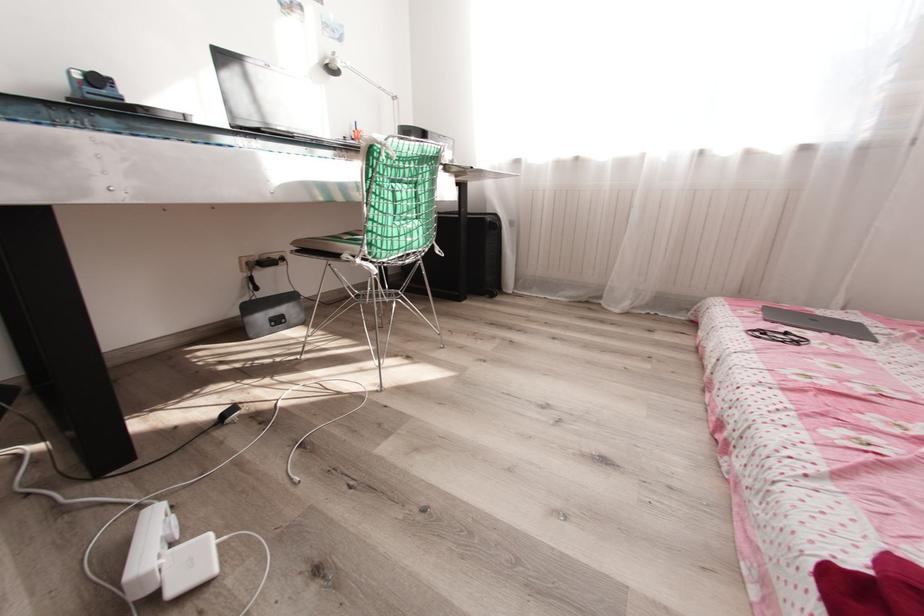
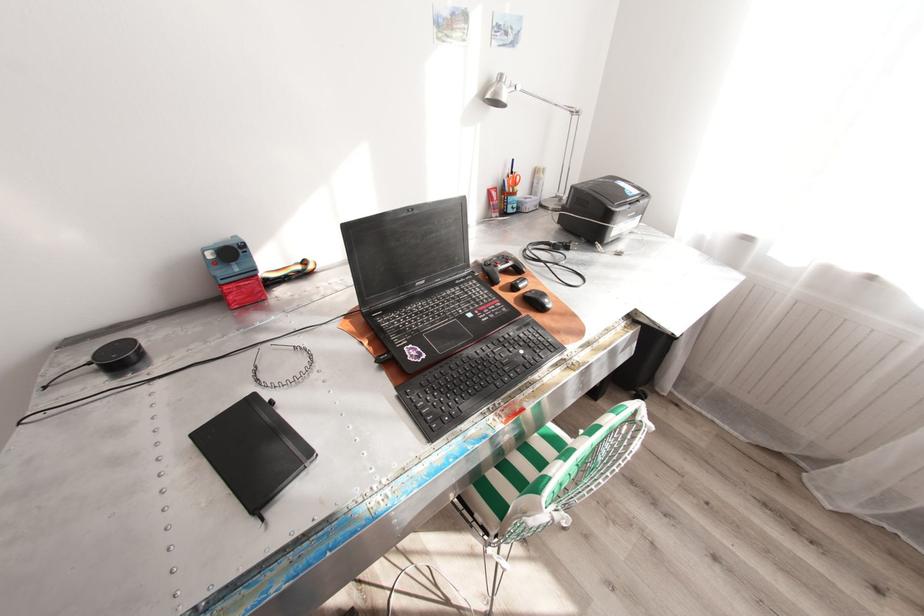
Where in the second image is the point corresponding to (x=338, y=54) from the first image?

(505, 76)